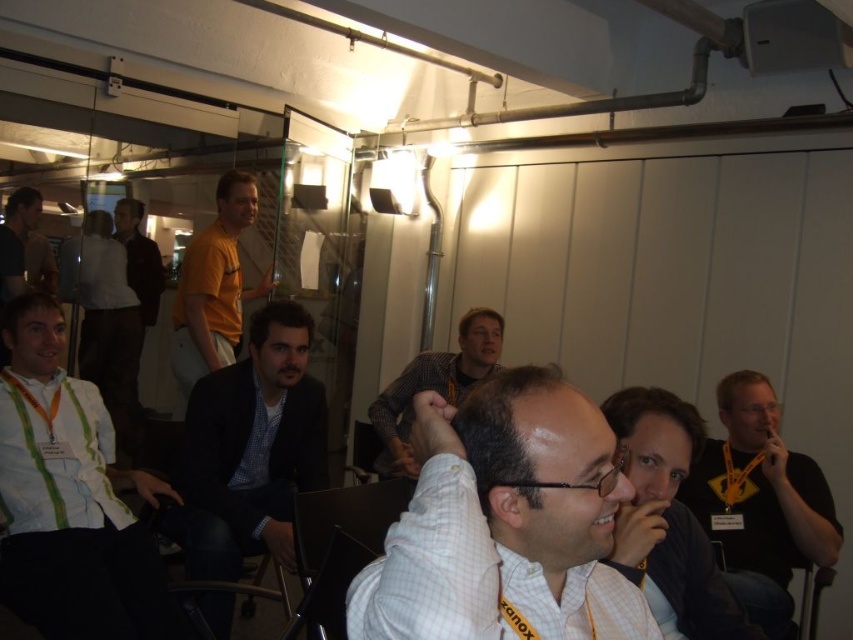
Question: Which object is farther from the camera taking this photo?

Choices:
 (A) orange t-shirt at center
 (B) white shirt at center

Answer: (A)

Question: Is the position of orange t-shirt at center more distant than that of dark brown leather jacket at upper left?

Choices:
 (A) yes
 (B) no

Answer: (B)

Question: Is dark blue textured blazer at center wider than orange t-shirt at center?

Choices:
 (A) yes
 (B) no

Answer: (A)

Question: Which of the following is the farthest from the observer?

Choices:
 (A) dark blue textured blazer at center
 (B) dark brown leather jacket at upper left
 (C) yellow lanyard at right
 (D) white striped shirt at lower left

Answer: (B)

Question: Estimate the real-world distances between objects in this image. Which object is farther from the dark blue textured blazer at center?

Choices:
 (A) orange t-shirt at center
 (B) white striped shirt at lower left
 (C) dark brown leather jacket at upper left

Answer: (C)

Question: Observing the image, what is the correct spatial positioning of orange t-shirt at center in reference to matte yellow shirt at left?

Choices:
 (A) right
 (B) left

Answer: (A)